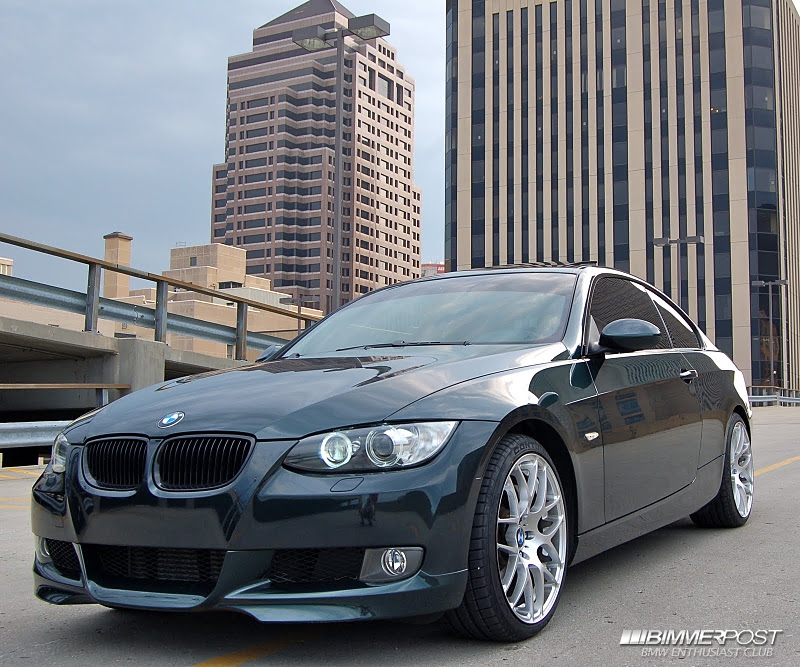
I want to click on hood, so click(x=352, y=385).